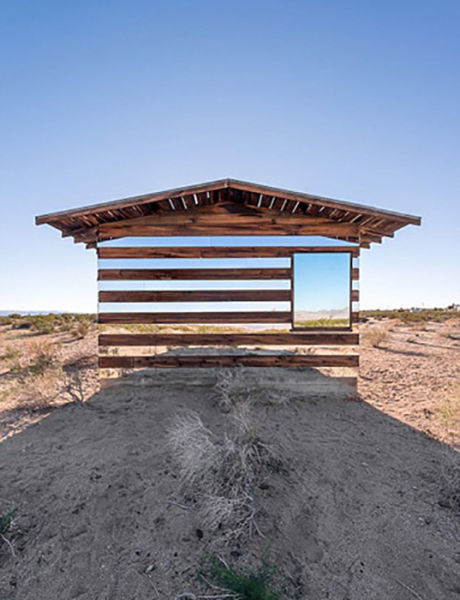
Locate an element on the screen. The image size is (460, 600). window is located at coordinates (321, 298).